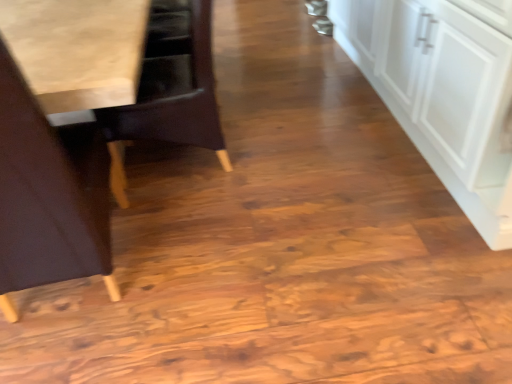
Question: Should I look upward or downward to see wooden chair at left, which is the 2th chair from front to back?

Choices:
 (A) down
 (B) up

Answer: (B)

Question: Is the depth of wooden chair at left, positioned as the first chair in back-to-front order, greater than that of white matte cabinet at right?

Choices:
 (A) no
 (B) yes

Answer: (B)

Question: Is wooden chair at left, positioned as the first chair in back-to-front order, closer to camera compared to white matte cabinet at right?

Choices:
 (A) no
 (B) yes

Answer: (A)

Question: Is wooden chair at left, which is the 2th chair from front to back, not within white matte cabinet at right?

Choices:
 (A) no
 (B) yes

Answer: (B)

Question: Is wooden chair at left, positioned as the first chair in back-to-front order, aimed at white matte cabinet at right?

Choices:
 (A) yes
 (B) no

Answer: (B)

Question: Is wooden chair at left, positioned as the first chair in back-to-front order, facing away from white matte cabinet at right?

Choices:
 (A) yes
 (B) no

Answer: (A)

Question: From the image's perspective, does wooden chair at left, which is the 2th chair from front to back, appear higher than white matte cabinet at right?

Choices:
 (A) yes
 (B) no

Answer: (B)

Question: Is white matte cabinet at right further to camera compared to wooden chair at left, positioned as the first chair in back-to-front order?

Choices:
 (A) yes
 (B) no

Answer: (B)

Question: Are white matte cabinet at right and wooden chair at left, which is the 2th chair from front to back, far apart?

Choices:
 (A) no
 (B) yes

Answer: (B)

Question: Is white matte cabinet at right wider than wooden chair at left, positioned as the first chair in back-to-front order?

Choices:
 (A) yes
 (B) no

Answer: (A)

Question: Is white matte cabinet at right at the right side of wooden chair at left, which is the 2th chair from front to back?

Choices:
 (A) no
 (B) yes

Answer: (B)

Question: Is white matte cabinet at right oriented away from wooden chair at left, which is the 2th chair from front to back?

Choices:
 (A) no
 (B) yes

Answer: (A)

Question: Could you tell me if white matte cabinet at right is turned towards wooden chair at left, which is the 2th chair from front to back?

Choices:
 (A) no
 (B) yes

Answer: (B)

Question: Is white matte cabinet at right taller than light brown wood chair at left, which is counted as the second chair, starting from the back?

Choices:
 (A) yes
 (B) no

Answer: (B)